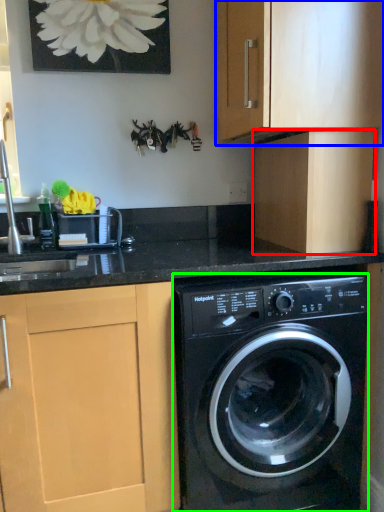
Question: Estimate the real-world distances between objects in this image. Which object is farther from cabinetry (highlighted by a red box), cabinetry (highlighted by a blue box) or washing machine (highlighted by a green box)?

Choices:
 (A) cabinetry
 (B) washing machine

Answer: (B)